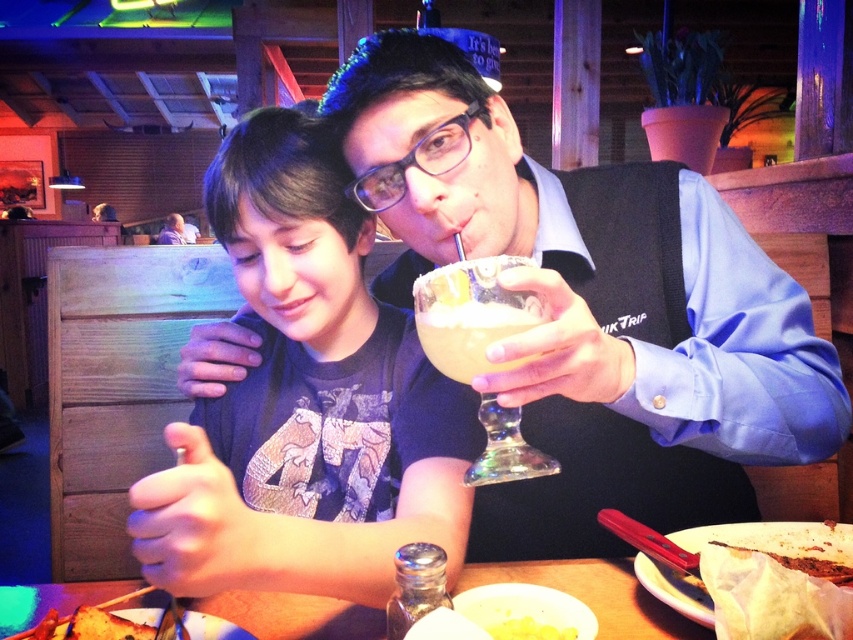
You are a waiter in a restaurant and need to place a new order on the table. The table has a yellow frothy drink at center. Where should you place the new order to avoid spilling the drink?

Place the new order away from the yellow frothy drink at center, which is located at coordinates approximately 0.519 on the x and 0.553 on the y axis, to prevent any accidental spills.

You are a server at the restaurant and need to place a new drink order for the customer seated at the wooden table at center. The new drink is a 9.5 inch wide cocktail. Can you place it on the table without moving the existing translucent glass margarita at center?

The wooden table at center and translucent glass margarita at center are 8.96 inches apart. Since the new drink is 9.5 inches wide, it would not fit between them without moving the existing translucent glass margarita at center.